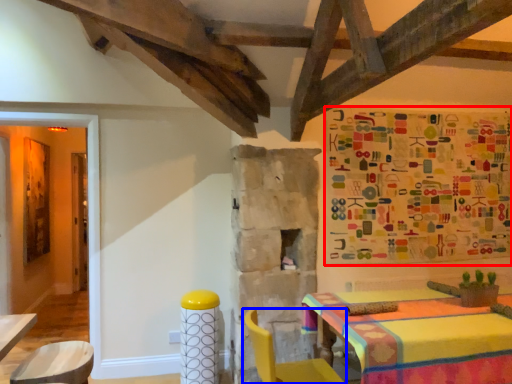
Question: Which object is further to the camera taking this photo, tapestry (highlighted by a red box) or chair (highlighted by a blue box)?

Choices:
 (A) tapestry
 (B) chair

Answer: (A)